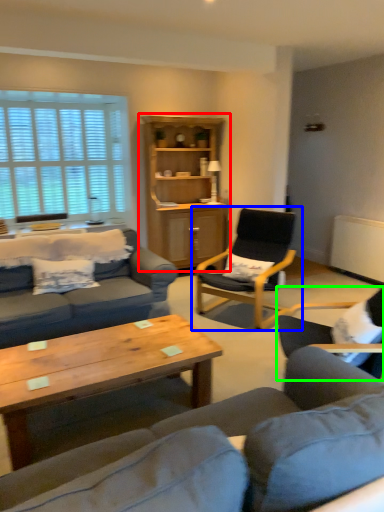
Question: Which object is the farthest from cabinetry (highlighted by a red box)? Choose among these: chair (highlighted by a blue box) or chair (highlighted by a green box).

Choices:
 (A) chair
 (B) chair

Answer: (B)